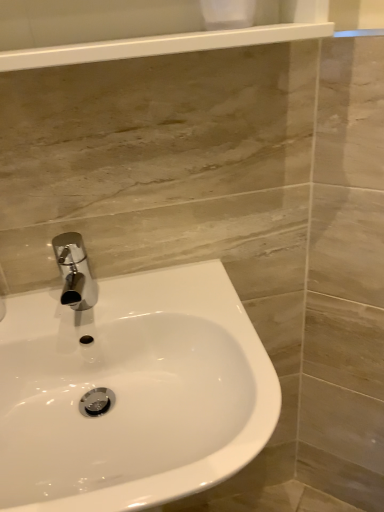
Question: Should I look upward or downward to see white glossy sink at center?

Choices:
 (A) down
 (B) up

Answer: (A)